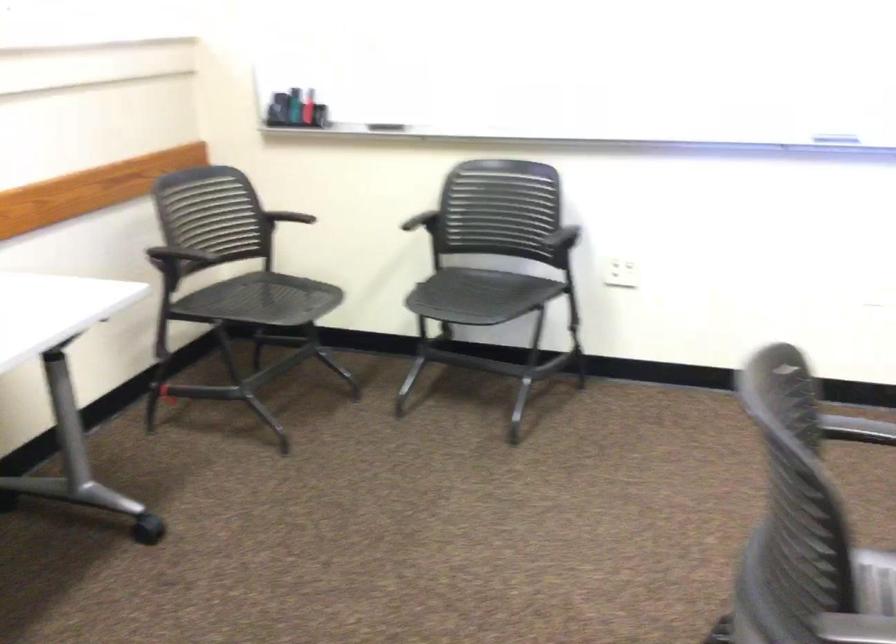
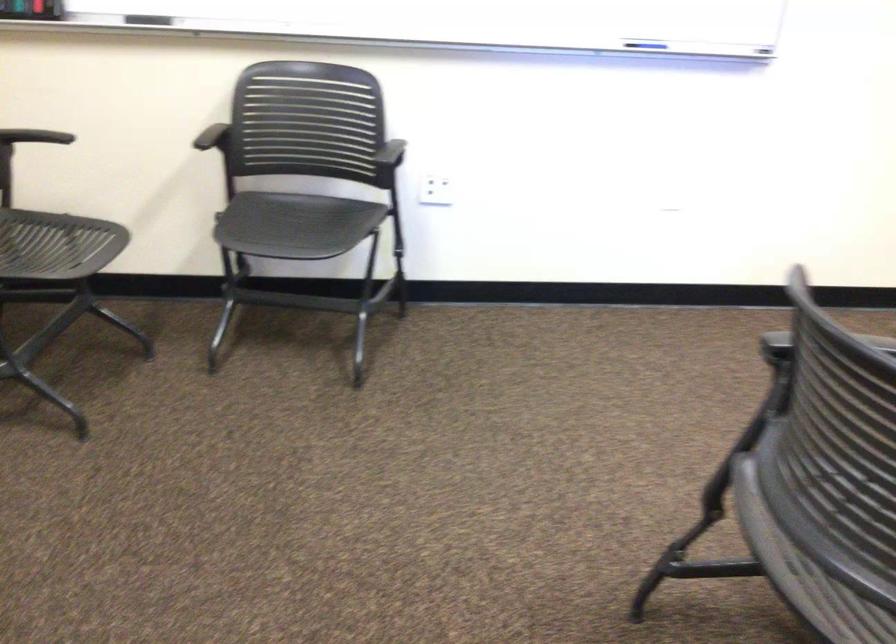
The point at (483, 296) is marked in the first image. Where is the corresponding point in the second image?

(295, 225)